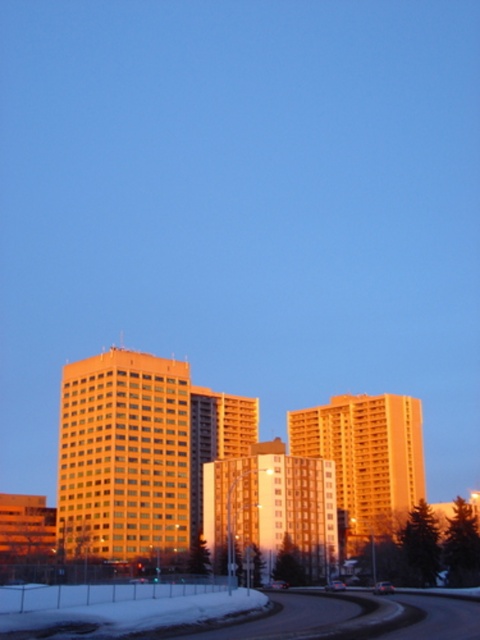
You are driving along the snowy asphalt highway at lower center and want to reach the golden glass building at center. According to the scene description, which direction should you head towards?

The golden glass building at center is further away from the viewer than the snowy asphalt highway at lower center, so you should drive towards the center of the image to reach it.

You are standing at the starting point and want to reach the destination. The starting point is the point at coordinates point (111, 490), and the destination is the point at coordinates point (354, 422). According to the scene, which direction should you move to go from the starting point to the destination?

To go from the starting point at point (111, 490) to the destination at point (354, 422), you should move upward because the destination point is above the starting point in the scene.

You are a city planner assessing the skyline of this urban area. Given the golden glass building at center and the orange glass building at center, which one would cast a longer shadow based on their sizes?

The golden glass building at center has a larger size compared to orange glass building at center, so it would cast a longer shadow.